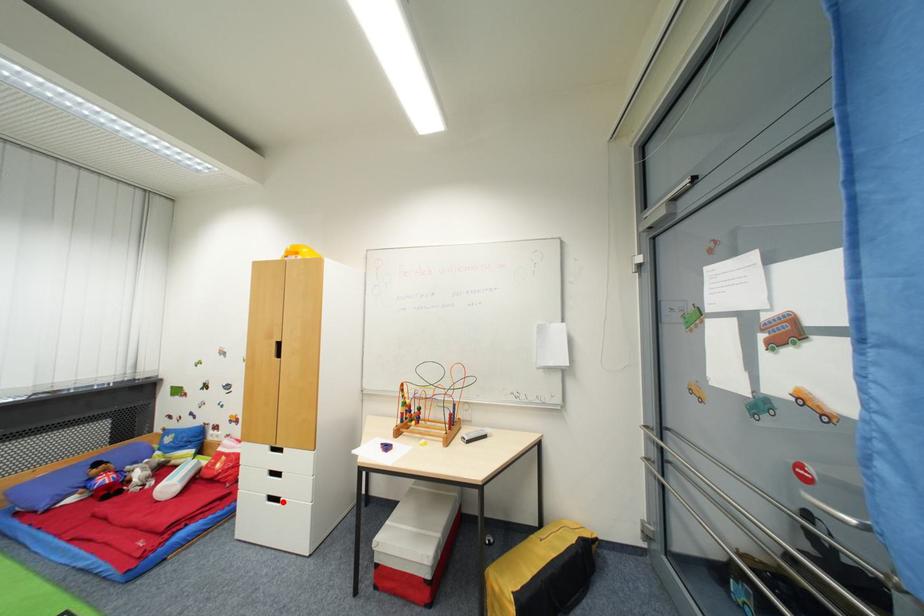
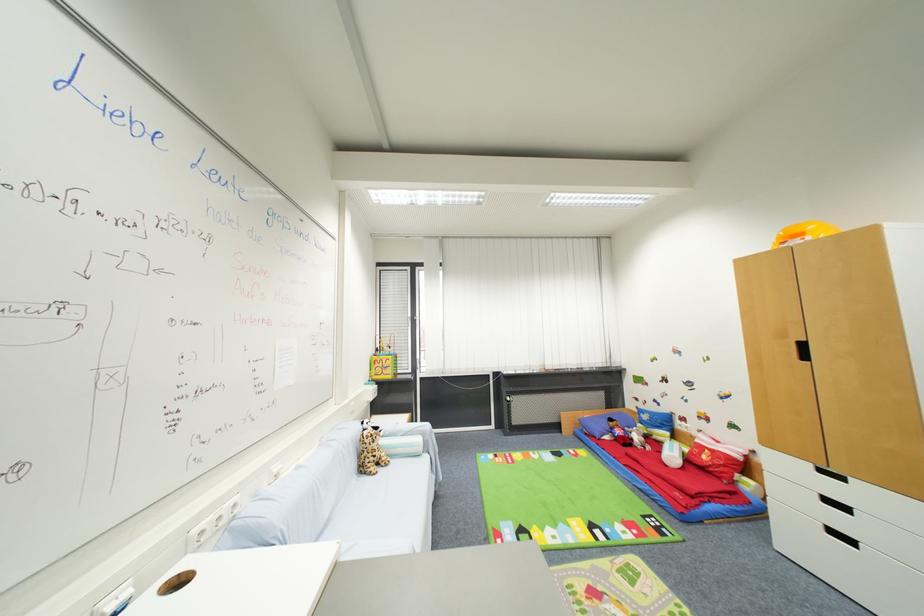
Question: I am providing you with two images of the same scene from different viewpoints. A red point is marked on the first image. Is the red point's position out of view in image 2?

Choices:
 (A) Yes
 (B) No

Answer: (B)